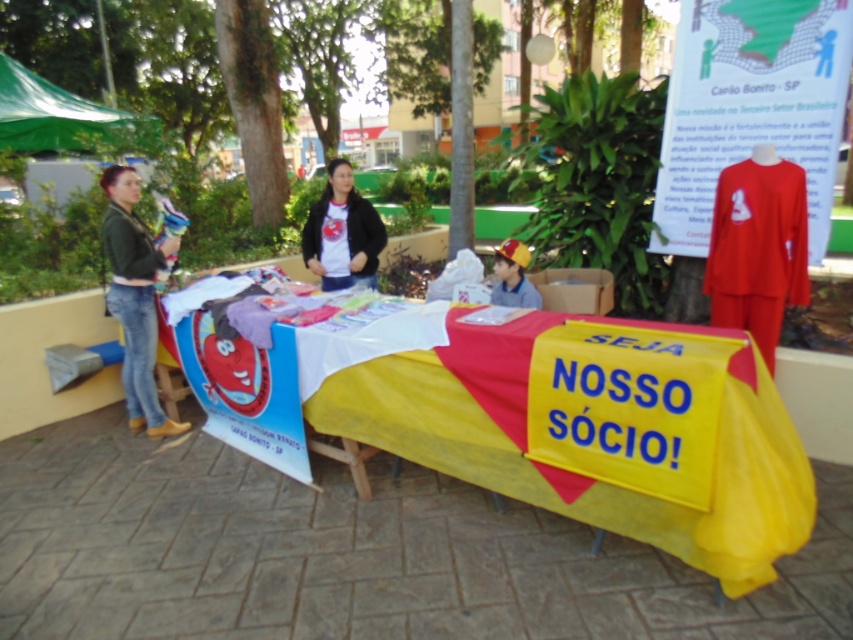
Based on the photo, you are a visitor at this event and want to take a closer look at the items on the table. Which object, the green matte jacket at left or the green fabric canopy at upper left, would you need to move first to access the items underneath?

The green matte jacket at left has a smaller size compared to the green fabric canopy at upper left, so you would need to move the green matte jacket at left first to access the items underneath since it is smaller and likely placed on top.

You are a visitor approaching the yellow fabric table at center and the green fabric canopy at upper left. Which object will you encounter first as you move towards the booth?

You will encounter the yellow fabric table at center first because it is closer to you than the green fabric canopy at upper left.

What are the coordinates of the yellow fabric table at center?

The yellow fabric table at center is located at coordinates point [595,429].